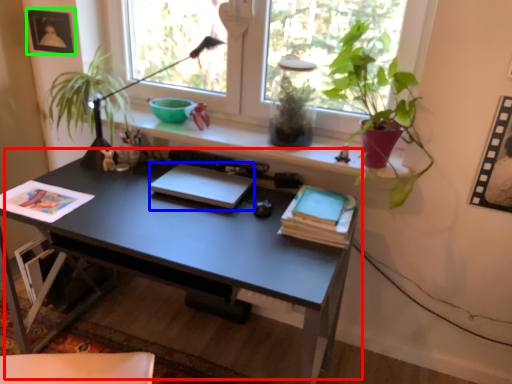
Question: Considering the real-world distances, which object is closest to desk (highlighted by a red box)? laptop (highlighted by a blue box) or picture frame (highlighted by a green box).

Choices:
 (A) laptop
 (B) picture frame

Answer: (A)